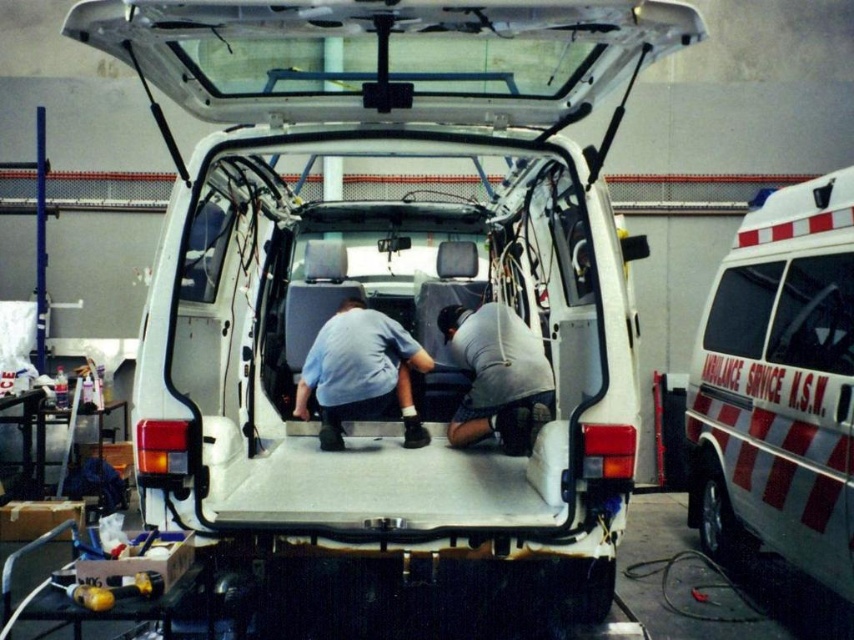
Is white glossy ambulance at right bigger than blue cotton shirt at center?

Indeed, white glossy ambulance at right has a larger size compared to blue cotton shirt at center.

The image size is (854, 640). Describe the element at coordinates (384, 301) in the screenshot. I see `white glossy ambulance at right` at that location.

Locate an element on the screen. This screenshot has width=854, height=640. white glossy ambulance at right is located at coordinates 384,301.

Can you confirm if white glossy ambulance at upper right is smaller than blue cotton shirt at center?

No.

Can you confirm if white glossy ambulance at upper right is positioned to the right of blue cotton shirt at center?

Correct, you'll find white glossy ambulance at upper right to the right of blue cotton shirt at center.

Is point (793, 413) less distant than point (408, 436)?

Yes, it is in front of point (408, 436).

Where is `white glossy ambulance at upper right`? Image resolution: width=854 pixels, height=640 pixels. white glossy ambulance at upper right is located at coordinates (779, 387).

Can you confirm if blue cotton shirt at center is positioned below gray matte shirt at center?

Yes, blue cotton shirt at center is below gray matte shirt at center.

Describe the element at coordinates (361, 372) in the screenshot. Image resolution: width=854 pixels, height=640 pixels. I see `blue cotton shirt at center` at that location.

Is point (379, 333) positioned in front of point (452, 346)?

Yes, it is in front of point (452, 346).

Locate an element on the screen. This screenshot has width=854, height=640. blue cotton shirt at center is located at coordinates (361, 372).